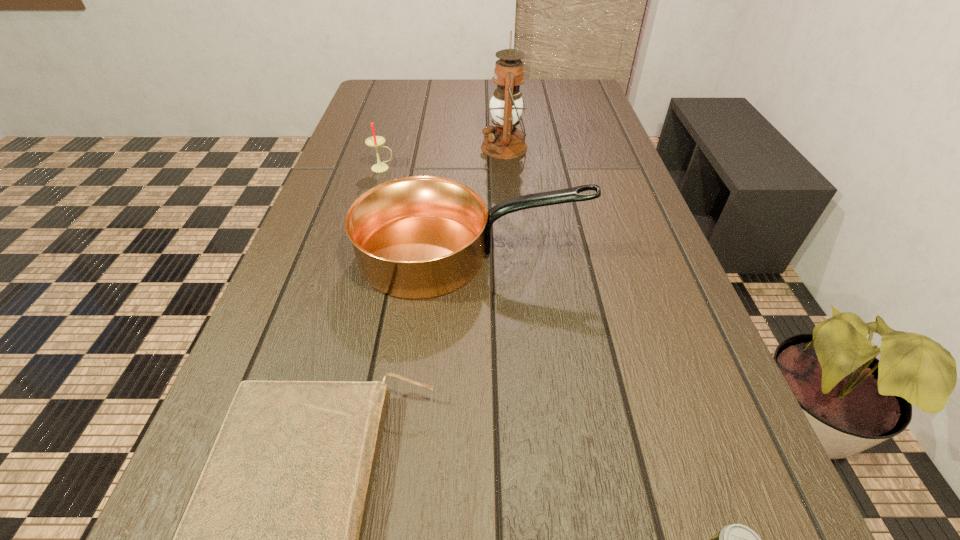
Find the location of a particular element. The width and height of the screenshot is (960, 540). candle located in the left edge section of the desktop is located at coordinates (375, 141).

The height and width of the screenshot is (540, 960). What are the coordinates of `vacant space at the far edge` in the screenshot? It's located at (490, 84).

Identify the location of vacant space at the left edge of the desktop. (363, 130).

Identify the location of free space at the right edge. This screenshot has height=540, width=960. (656, 267).

This screenshot has width=960, height=540. Identify the location of free space at the far left corner of the desktop. (369, 108).

Identify the location of free area in between the lantern and the third tallest object. This screenshot has height=540, width=960. (444, 158).

This screenshot has height=540, width=960. Find the location of `free space between the third nearest object and the lantern`. free space between the third nearest object and the lantern is located at coordinates (488, 201).

This screenshot has width=960, height=540. In order to click on free space between the tallest object and the third tallest object in this screenshot , I will do (x=444, y=158).

Identify the location of the fourth closest object to the rightmost object. (375, 141).

Identify which object is the third nearest to the lantern. Please provide its 2D coordinates. Your answer should be formatted as a tuple, i.e. [(x, y)], where the tuple contains the x and y coordinates of a point satisfying the conditions above.

[(271, 539)]